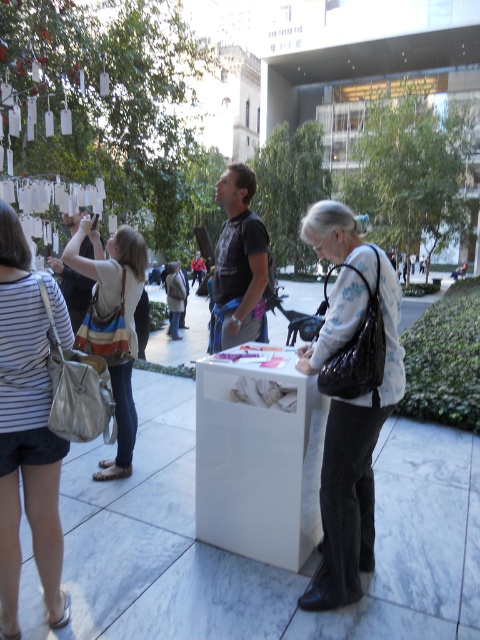
The image size is (480, 640). What do you see at coordinates (349, 403) in the screenshot? I see `matte black purse at center` at bounding box center [349, 403].

Is matte black purse at center to the right of striped fabric purse at left from the viewer's perspective?

Yes, matte black purse at center is to the right of striped fabric purse at left.

Does point (321, 209) come closer to viewer compared to point (121, 422)?

Yes, it is.

Locate an element on the screen. The height and width of the screenshot is (640, 480). matte black purse at center is located at coordinates (349, 403).

Describe the element at coordinates (25, 433) in the screenshot. The width and height of the screenshot is (480, 640). I see `striped fabric shirt at left` at that location.

Does striped fabric shirt at left have a greater width compared to striped fabric purse at left?

In fact, striped fabric shirt at left might be narrower than striped fabric purse at left.

At what (x,y) coordinates should I click in order to perform the action: click on striped fabric shirt at left. Please return your answer as a coordinate pair (x, y). Looking at the image, I should click on (25, 433).

Is matte black purse at center taller than striped fabric shirt at left?

Incorrect, matte black purse at center's height is not larger of striped fabric shirt at left's.

Who is more distant from viewer, (322, 572) or (56, 314)?

Positioned behind is point (322, 572).

At what (x,y) coordinates should I click in order to perform the action: click on matte black purse at center. Please return your answer as a coordinate pair (x, y). The width and height of the screenshot is (480, 640). Looking at the image, I should click on (349, 403).

At what (x,y) coordinates should I click in order to perform the action: click on matte black purse at center. Please return your answer as a coordinate pair (x, y). The width and height of the screenshot is (480, 640). Looking at the image, I should click on (349, 403).